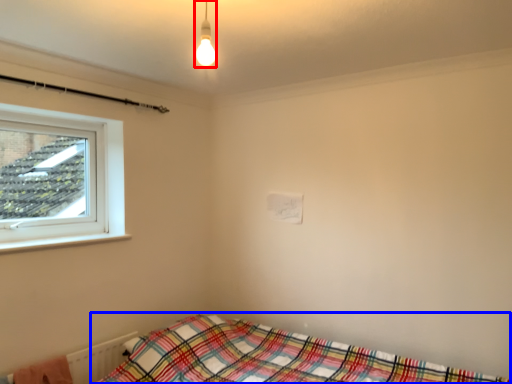
Question: Which point is closer to the camera, light fixture (highlighted by a red box) or bed (highlighted by a blue box)?

Choices:
 (A) light fixture
 (B) bed

Answer: (B)